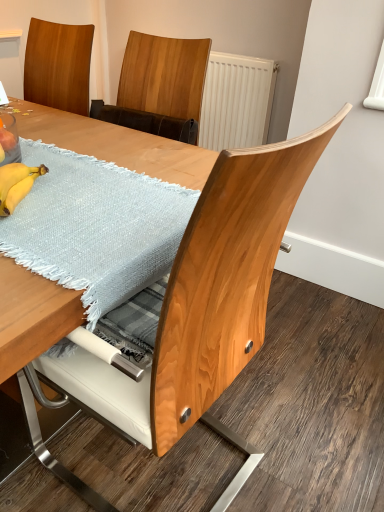
Locate an element on the screen. The width and height of the screenshot is (384, 512). empty space that is to the right of yellow matte bananas at lower left is located at coordinates (98, 211).